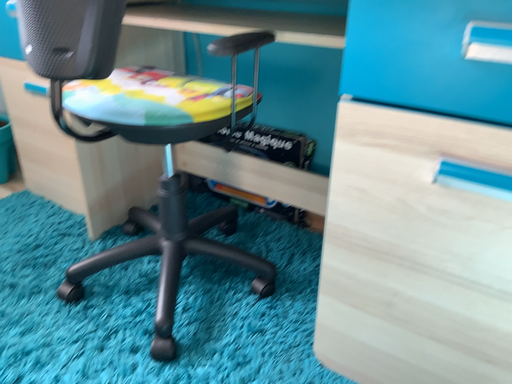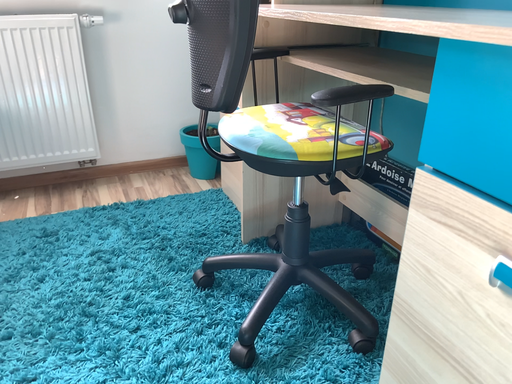
Question: Which way did the camera rotate in the video?

Choices:
 (A) rotated downward
 (B) rotated upward

Answer: (B)